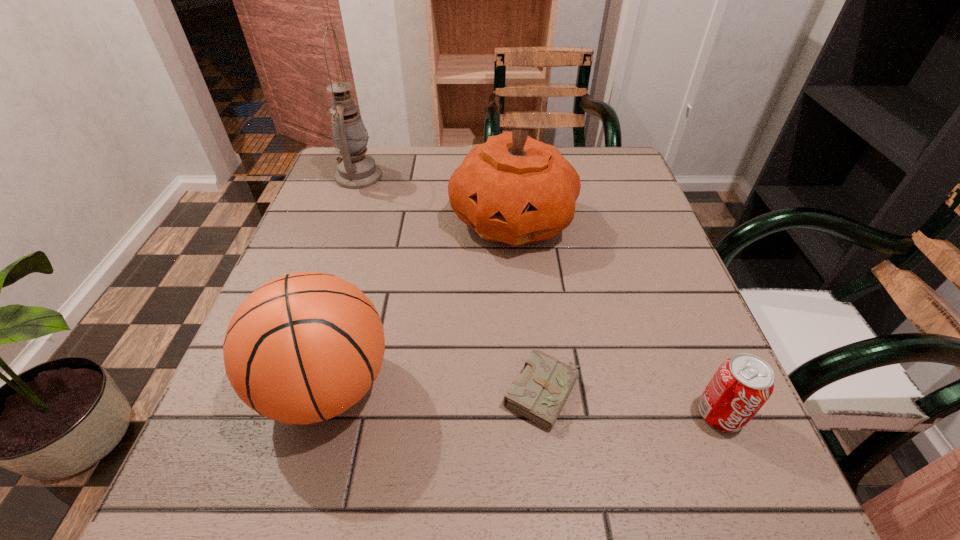
Where is `the tallest object`? This screenshot has height=540, width=960. the tallest object is located at coordinates (x=356, y=170).

Locate an element on the screen. The height and width of the screenshot is (540, 960). pumpkin is located at coordinates (513, 189).

You are a GUI agent. You are given a task and a screenshot of the screen. Output one action in this format:
    pyautogui.click(x=<x>, y=<y>)
    Task: Click on the basketball
    Image resolution: width=960 pixels, height=540 pixels.
    Given the screenshot: What is the action you would take?
    pyautogui.click(x=304, y=347)

Locate an element on the screen. the rightmost object is located at coordinates tap(742, 384).

Find the location of `the fourth tallest object`. the fourth tallest object is located at coordinates tap(742, 384).

The height and width of the screenshot is (540, 960). I want to click on diary, so click(x=540, y=393).

Find the location of a particular element. This screenshot has width=960, height=540. free space located on the right of the oil lamp is located at coordinates (528, 176).

Locate an element on the screen. The height and width of the screenshot is (540, 960). free location located 0.120m on the front-facing side of the pumpkin is located at coordinates pos(519,306).

Locate an element on the screen. Image resolution: width=960 pixels, height=540 pixels. vacant area located on the back of the basketball is located at coordinates (377, 205).

The image size is (960, 540). I want to click on blank space located on the back of the soda, so click(x=688, y=338).